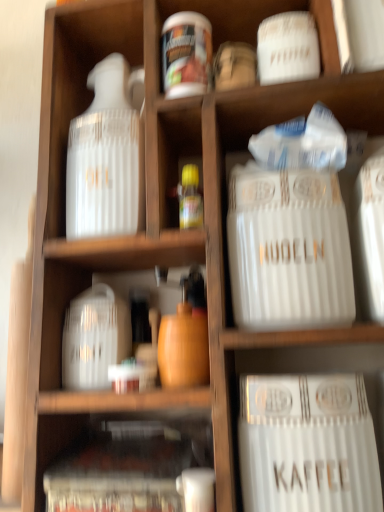
Question: Could white glossy jar at upper center be considered to be inside white ceramic canister at center right?

Choices:
 (A) yes
 (B) no

Answer: (B)

Question: Considering the relative sizes of white ceramic canister at center right and white glossy jar at upper center in the image provided, is white ceramic canister at center right wider than white glossy jar at upper center?

Choices:
 (A) yes
 (B) no

Answer: (A)

Question: Considering the relative positions of white ceramic canister at center right and white glossy jar at upper center in the image provided, is white ceramic canister at center right to the left of white glossy jar at upper center from the viewer's perspective?

Choices:
 (A) yes
 (B) no

Answer: (B)

Question: From the image's perspective, does white ceramic canister at center right appear lower than white glossy jar at upper center?

Choices:
 (A) no
 (B) yes

Answer: (B)

Question: Is white ceramic canister at center right smaller than white glossy jar at upper center?

Choices:
 (A) no
 (B) yes

Answer: (A)

Question: Is point [122, 501] closer or farther from the camera than point [276, 313]?

Choices:
 (A) farther
 (B) closer

Answer: (B)

Question: From a real-world perspective, is translucent plastic container at lower left, which appears as the second cabinet when viewed from the top, above or below white ceramic canister at center right?

Choices:
 (A) below
 (B) above

Answer: (A)

Question: Is translucent plastic container at lower left, which ranks as the 1th cabinet in bottom-to-top order, inside or outside of white ceramic canister at center right?

Choices:
 (A) outside
 (B) inside

Answer: (A)

Question: Is translucent plastic container at lower left, which appears as the second cabinet when viewed from the top, bigger or smaller than white ceramic canister at center right?

Choices:
 (A) small
 (B) big

Answer: (A)

Question: Visually, is white plastic container at center, which ranks as the first cabinet in top-to-bottom order, positioned to the left or to the right of white ceramic canister at center right?

Choices:
 (A) left
 (B) right

Answer: (A)

Question: Is white plastic container at center, the second cabinet from the bottom, wider or thinner than white ceramic canister at center right?

Choices:
 (A) wide
 (B) thin

Answer: (A)

Question: Is white plastic container at center, which ranks as the first cabinet in top-to-bottom order, spatially inside white ceramic canister at center right, or outside of it?

Choices:
 (A) inside
 (B) outside

Answer: (B)

Question: From the image's perspective, is white plastic container at center, the second cabinet from the bottom, located above or below white ceramic canister at center right?

Choices:
 (A) above
 (B) below

Answer: (B)

Question: From their relative heights in the image, would you say translucent plastic container at lower left, which appears as the second cabinet when viewed from the top, is taller or shorter than white glossy jar at upper center?

Choices:
 (A) short
 (B) tall

Answer: (A)

Question: From a real-world perspective, is translucent plastic container at lower left, which ranks as the 1th cabinet in bottom-to-top order, positioned above or below white glossy jar at upper center?

Choices:
 (A) below
 (B) above

Answer: (A)